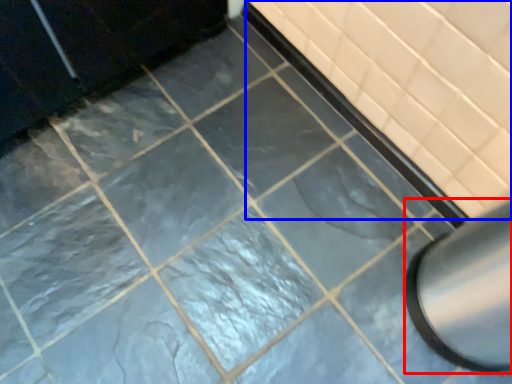
Question: Which point is closer to the camera, exhaust hood (highlighted by a red box) or bath (highlighted by a blue box)?

Choices:
 (A) exhaust hood
 (B) bath

Answer: (A)